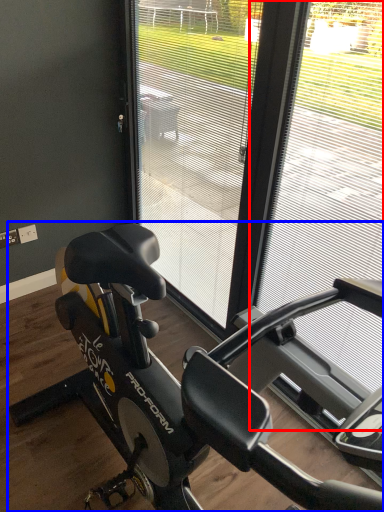
Question: Which of the following is the closest to the observer, window frame (highlighted by a red box) or stationary bicycle (highlighted by a blue box)?

Choices:
 (A) window frame
 (B) stationary bicycle

Answer: (A)